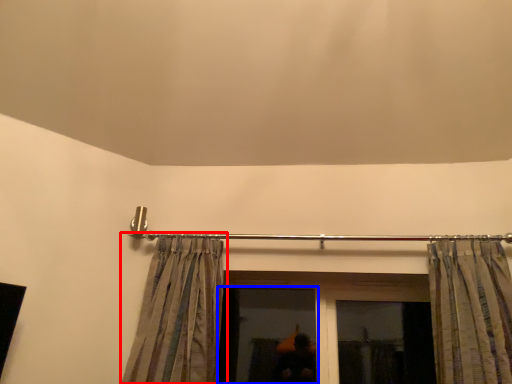
Question: Which of the following is the farthest to the observer, curtain (highlighted by a red box) or window (highlighted by a blue box)?

Choices:
 (A) curtain
 (B) window

Answer: (B)